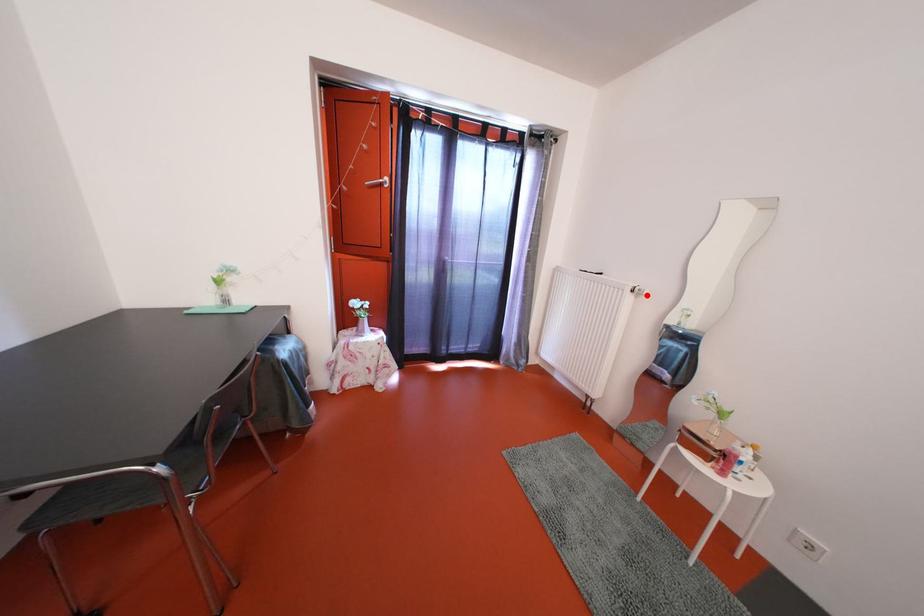
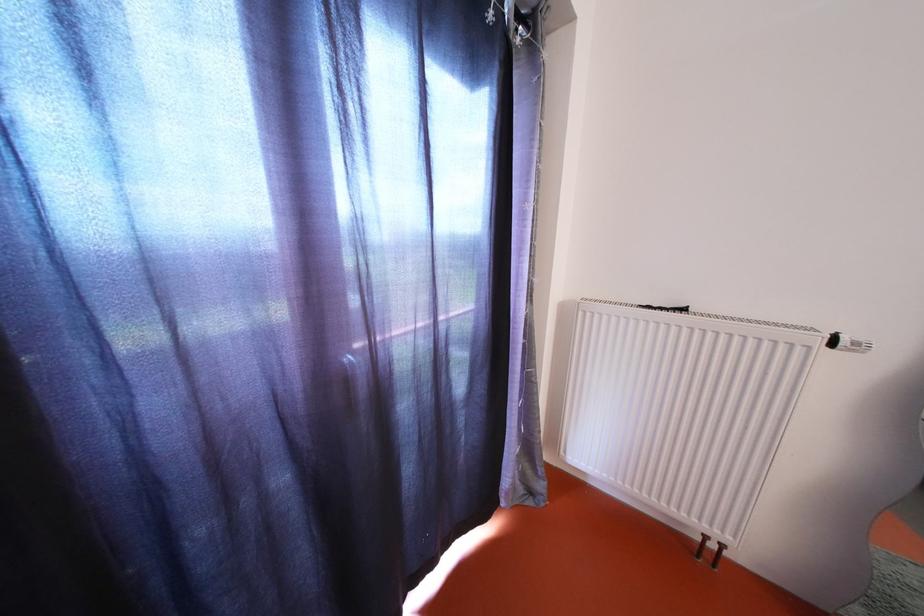
Question: I am providing you with two images of the same scene from different viewpoints. Image1 has a red point marked. In image2, the corresponding 3D location appears at what relative position? Reply with the corresponding letter.

Choices:
 (A) Closer
 (B) Farther

Answer: (A)